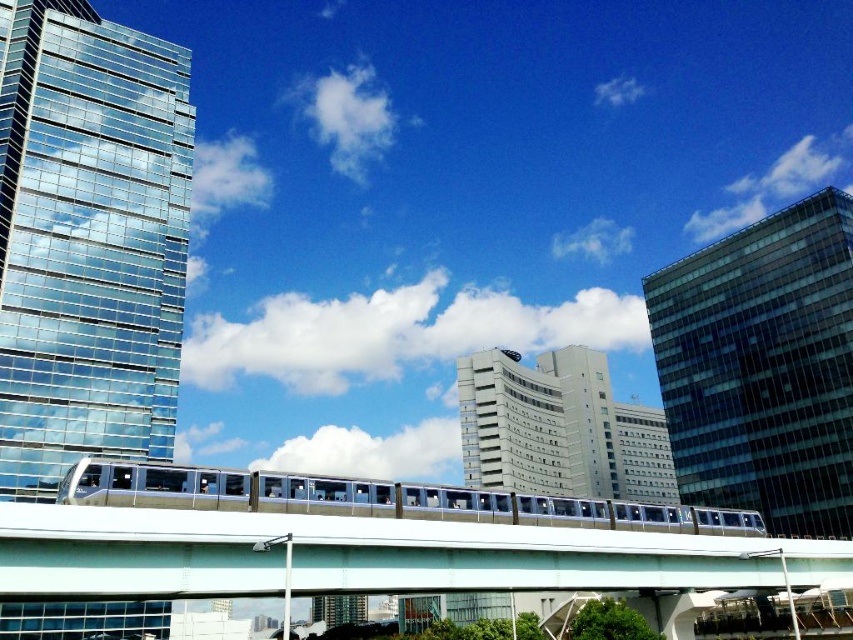
Describe the element at coordinates (88, 237) in the screenshot. I see `transparent glass skyscraper at left` at that location.

Is point (3, 308) behind point (131, 464)?

Yes.

Is point (20, 280) positioned before point (706, 522)?

No, it is behind (706, 522).

What are the coordinates of `transparent glass skyscraper at left` in the screenshot? It's located at (88, 237).

In the scene shown: Is white glossy overpass at center thinner than silver metallic train at center?

Indeed, white glossy overpass at center has a lesser width compared to silver metallic train at center.

Between white glossy overpass at center and silver metallic train at center, which one appears on the left side from the viewer's perspective?

silver metallic train at center is more to the left.

Find the location of `white glossy overpass at center`. white glossy overpass at center is located at coordinates (372, 556).

From the picture: Is transparent glass skyscraper at left further to the viewer compared to white glossy overpass at center?

Yes, it is behind white glossy overpass at center.

Is point (16, 186) more distant than point (173, 516)?

Yes, point (16, 186) is farther from viewer.

What are the coordinates of `transparent glass skyscraper at left` in the screenshot? It's located at (88, 237).